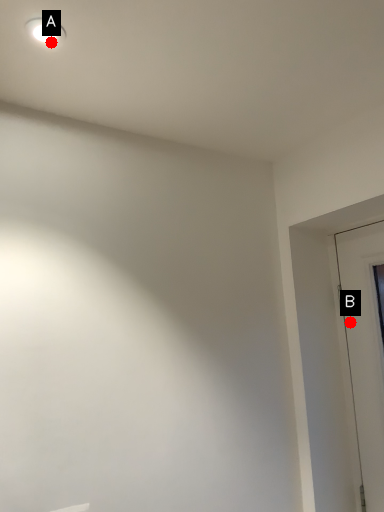
Question: Two points are circled on the image, labeled by A and B beside each circle. Which point is closer to the camera taking this photo?

Choices:
 (A) A is closer
 (B) B is closer

Answer: (A)